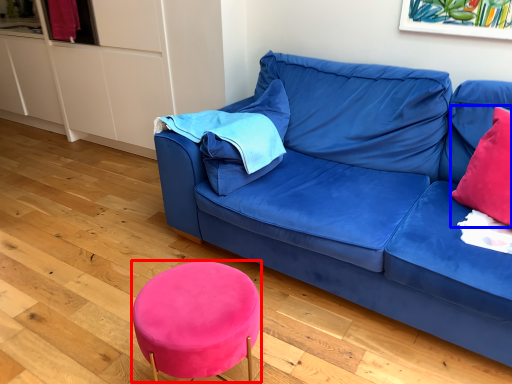
Question: Which of the following is the closest to the observer, bar stool (highlighted by a red box) or throw pillow (highlighted by a blue box)?

Choices:
 (A) bar stool
 (B) throw pillow

Answer: (A)